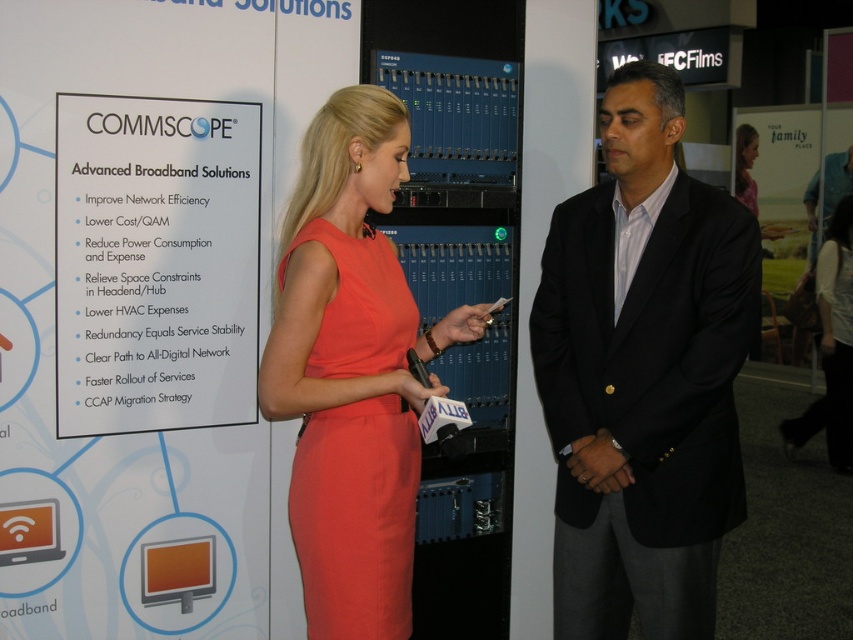
Question: Which object appears farthest from the camera in this image?

Choices:
 (A) black suit at center
 (B) coral satin dress at center
 (C) pink fabric dress at upper center

Answer: (C)

Question: Which object appears closest to the camera in this image?

Choices:
 (A) orange fabric dress at center
 (B) white paper at upper left
 (C) black suit at center
 (D) coral satin dress at center

Answer: (A)

Question: Is white paper at upper left above pink fabric dress at upper center?

Choices:
 (A) no
 (B) yes

Answer: (A)

Question: Which point is closer to the camera?

Choices:
 (A) white paper at upper left
 (B) pink fabric dress at upper center
 (C) orange fabric dress at center

Answer: (C)

Question: Is orange fabric dress at center further to the viewer compared to coral satin dress at center?

Choices:
 (A) yes
 (B) no

Answer: (B)

Question: Is white paper at upper left bigger than orange fabric dress at center?

Choices:
 (A) yes
 (B) no

Answer: (A)